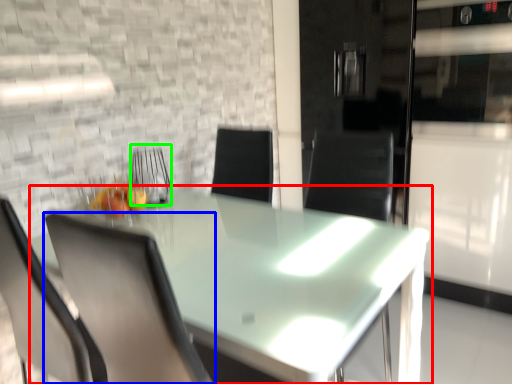
Question: Considering the real-world distances, which object is closest to table (highlighted by a red box)? chair (highlighted by a blue box) or armchair (highlighted by a green box).

Choices:
 (A) chair
 (B) armchair

Answer: (A)